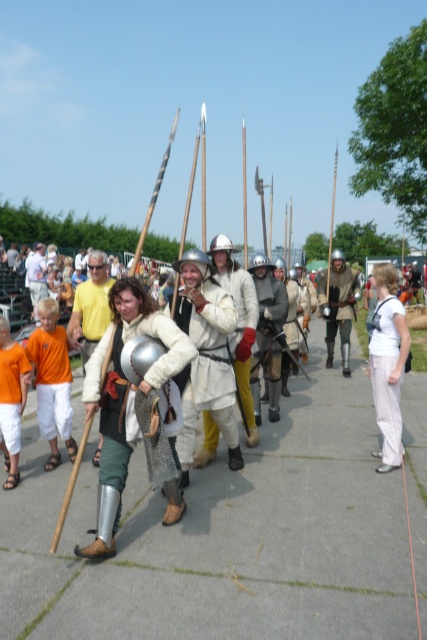
Who is positioned more to the left, white cotton pants at center or leather armor at center?

white cotton pants at center

Which of these two, white cotton pants at center or leather armor at center, stands taller?

leather armor at center is taller.

Is point (392, 403) farther from camera compared to point (319, 291)?

No.

I want to click on white cotton pants at center, so click(388, 371).

Does chainmail shirt at center appear over orange cotton shirt at left?

No, chainmail shirt at center is not above orange cotton shirt at left.

Is chainmail shirt at center below orange cotton shirt at left?

Yes, chainmail shirt at center is below orange cotton shirt at left.

Describe the element at coordinates (125, 396) in the screenshot. I see `chainmail shirt at center` at that location.

You are a GUI agent. You are given a task and a screenshot of the screen. Output one action in this format:
    pyautogui.click(x=<x>, y=<y>)
    Task: Click on the chainmail shirt at center
    
    Given the screenshot: What is the action you would take?
    [125, 396]

Image resolution: width=427 pixels, height=640 pixels. I want to click on orange cotton shirt at left, so click(x=52, y=380).

Who is more forward, (55, 445) or (351, 301)?

Point (55, 445) is more forward.

Is point (47, 403) in front of point (345, 346)?

Yes, point (47, 403) is in front of point (345, 346).

Where is `orange cotton shirt at left`? orange cotton shirt at left is located at coordinates (52, 380).